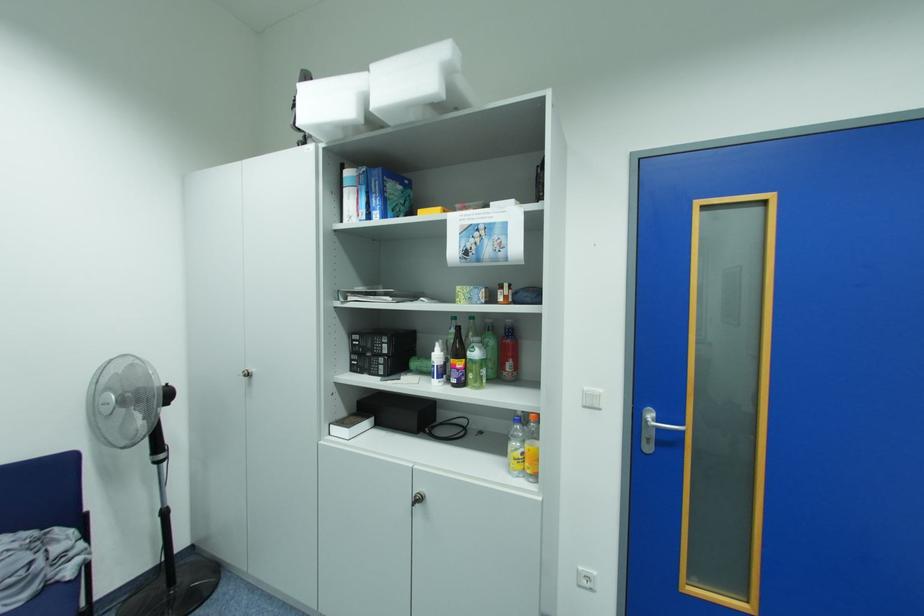
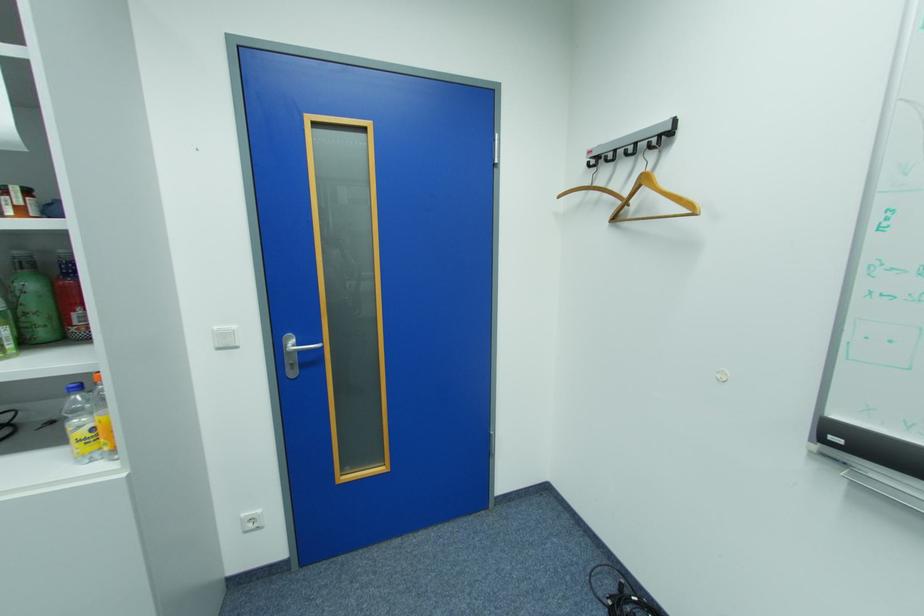
Locate, in the second image, the point that corresponds to pixel 500 342 in the first image.

(41, 286)